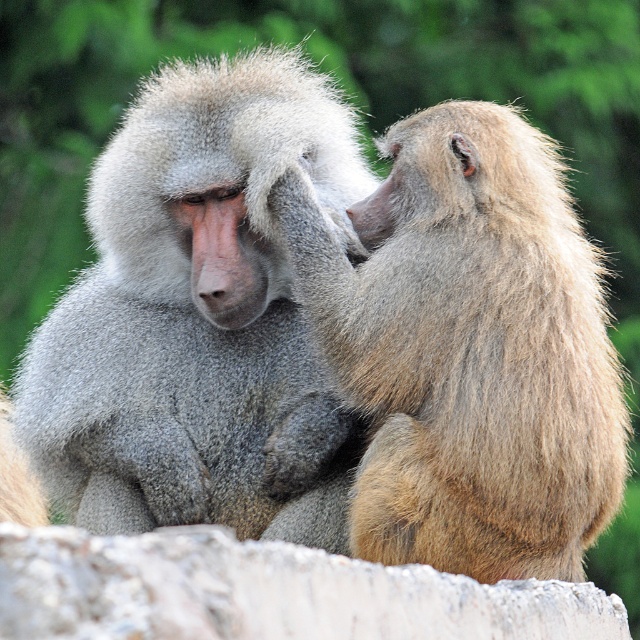
Which is in front, point (76, 504) or point (452, 324)?

Point (452, 324) is more forward.

In the scene shown: Is gray fur monkey at left below gray fur monkey at center?

No.

Does point (230, 240) come closer to viewer compared to point (552, 460)?

No.

Where is `gray fur monkey at left`? gray fur monkey at left is located at coordinates (196, 314).